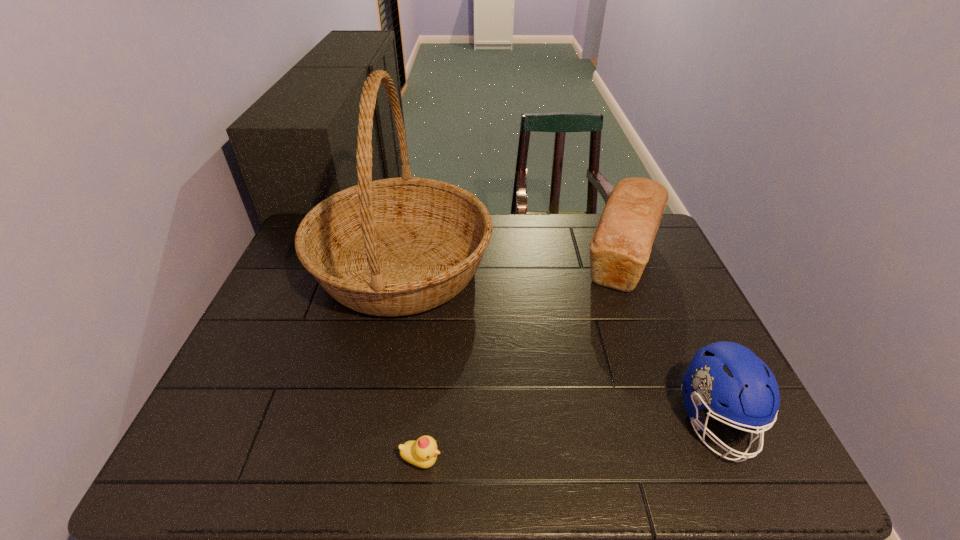
Find the location of a particular element. The image size is (960, 540). vacant area that lies between the football helmet and the third shortest object is located at coordinates (669, 340).

Identify the location of free space between the bread and the tallest object. This screenshot has width=960, height=540. pos(512,263).

You are a GUI agent. You are given a task and a screenshot of the screen. Output one action in this format:
    pyautogui.click(x=<x>, y=<y>)
    Task: Click on the vacant region between the football helmet and the bread
    The width and height of the screenshot is (960, 540).
    Given the screenshot: What is the action you would take?
    pyautogui.click(x=669, y=340)

The width and height of the screenshot is (960, 540). In order to click on object that is the nearest to the football helmet in this screenshot , I will do pos(620,247).

Locate which object is the second closest to the football helmet. Please provide its 2D coordinates. Your answer should be formatted as a tuple, i.e. [(x, y)], where the tuple contains the x and y coordinates of a point satisfying the conditions above.

[(400, 246)]

Identify the location of free spot that satisfies the following two spatial constraints: 1. on the face guard of the football helmet; 2. on the front-facing side of the duckling. The image size is (960, 540). (734, 461).

You are a GUI agent. You are given a task and a screenshot of the screen. Output one action in this format:
    pyautogui.click(x=<x>, y=<y>)
    Task: Click on the free space that satisfies the following two spatial constraints: 1. on the front side of the second tallest object; 2. on the front-facing side of the duckling
    Image resolution: width=960 pixels, height=540 pixels.
    Given the screenshot: What is the action you would take?
    pyautogui.click(x=700, y=461)